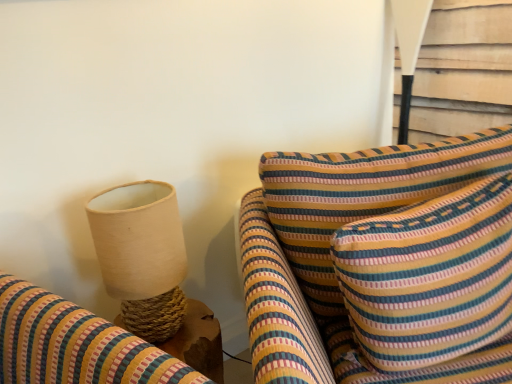
This screenshot has height=384, width=512. I want to click on natural woven lampshade at left, positioned as the 1th table lamp in bottom-to-top order, so click(142, 255).

At what (x,y) coordinates should I click in order to perform the action: click on table lamp on the left side of white fabric lampshade at upper right, positioned as the 2th table lamp in front-to-back order. Please return your answer as a coordinate pair (x, y). Looking at the image, I should click on (142, 255).

Which point is more distant from viewer, (134, 238) or (420, 16)?

The point (420, 16) is more distant.

Between natural woven lampshade at left, the second table lamp when ordered from right to left, and white fabric lampshade at upper right, the 2th table lamp positioned from the left, which one has smaller size?

white fabric lampshade at upper right, the 2th table lamp positioned from the left, is smaller.

From the image's perspective, which one is positioned higher, natural woven lampshade at left, the 1th table lamp positioned from the left, or white fabric lampshade at upper right, the 1th table lamp in the right-to-left sequence?

white fabric lampshade at upper right, the 1th table lamp in the right-to-left sequence.

Is striped fabric cushion at center behind natural woven lampshade at left, the second table lamp when ordered from right to left?

No, it is in front of natural woven lampshade at left, the second table lamp when ordered from right to left.

From a real-world perspective, between striped fabric cushion at center and natural woven lampshade at left, the 1th table lamp positioned from the left, who is vertically lower?

striped fabric cushion at center, from a real-world perspective.

Considering the sizes of objects striped fabric cushion at center and natural woven lampshade at left, the 1th table lamp positioned from the left, in the image provided, who is thinner, striped fabric cushion at center or natural woven lampshade at left, the 1th table lamp positioned from the left,?

natural woven lampshade at left, the 1th table lamp positioned from the left, is thinner.

What's the angular difference between white fabric lampshade at upper right, the 2th table lamp positioned from the left, and striped fabric cushion at center's facing directions?

The facing directions of white fabric lampshade at upper right, the 2th table lamp positioned from the left, and striped fabric cushion at center are 63.4 degrees apart.

Which point is more distant from viewer, [406,87] or [306,257]?

The point [406,87] is farther from the camera.

I want to click on furniture that appears below the white fabric lampshade at upper right, which appears as the first table lamp when viewed from the back (from a real-world perspective), so click(382, 263).

Is white fabric lampshade at upper right, positioned as the 2th table lamp in front-to-back order, shorter than striped fabric cushion at center?

Correct, white fabric lampshade at upper right, positioned as the 2th table lamp in front-to-back order, is not as tall as striped fabric cushion at center.

Considering the sizes of objects white fabric lampshade at upper right, the second table lamp positioned from the bottom, and natural woven lampshade at left, arranged as the second table lamp when viewed from the top, in the image provided, who is wider, white fabric lampshade at upper right, the second table lamp positioned from the bottom, or natural woven lampshade at left, arranged as the second table lamp when viewed from the top,?

Wider between the two is natural woven lampshade at left, arranged as the second table lamp when viewed from the top.

Is white fabric lampshade at upper right, the second table lamp positioned from the bottom, facing towards natural woven lampshade at left, which appears as the 2th table lamp when viewed from the back?

Yes, white fabric lampshade at upper right, the second table lamp positioned from the bottom, faces towards natural woven lampshade at left, which appears as the 2th table lamp when viewed from the back.

Is white fabric lampshade at upper right, acting as the first table lamp starting from the top, at the right side of natural woven lampshade at left, acting as the first table lamp starting from the front?

Yes.

Does point (162, 227) come behind point (408, 191)?

No, it is not.

Considering the sizes of objects natural woven lampshade at left, the 1th table lamp positioned from the left, and striped fabric cushion at center in the image provided, who is wider, natural woven lampshade at left, the 1th table lamp positioned from the left, or striped fabric cushion at center?

Wider between the two is striped fabric cushion at center.

Is natural woven lampshade at left, acting as the first table lamp starting from the front, completely or partially outside of striped fabric cushion at center?

Yes, natural woven lampshade at left, acting as the first table lamp starting from the front, is not within striped fabric cushion at center.

Consider the image. Is striped fabric cushion at center to the left of white fabric lampshade at upper right, the second table lamp positioned from the bottom, from the viewer's perspective?

Correct, you'll find striped fabric cushion at center to the left of white fabric lampshade at upper right, the second table lamp positioned from the bottom.

Considering the points (298, 279) and (400, 134), which point is behind, point (298, 279) or point (400, 134)?

Point (400, 134)

Is striped fabric cushion at center not near white fabric lampshade at upper right, the 1th table lamp in the right-to-left sequence?

Actually, striped fabric cushion at center and white fabric lampshade at upper right, the 1th table lamp in the right-to-left sequence, are a little close together.

Is striped fabric cushion at center taller than white fabric lampshade at upper right, the 2th table lamp positioned from the left?

Yes.

You are a GUI agent. You are given a task and a screenshot of the screen. Output one action in this format:
    pyautogui.click(x=<x>, y=<y>)
    Task: Click on the table lamp lying below the white fabric lampshade at upper right, positioned as the 2th table lamp in front-to-back order (from the image's perspective)
    The width and height of the screenshot is (512, 384).
    Given the screenshot: What is the action you would take?
    pyautogui.click(x=142, y=255)

Locate an element on the screen. The width and height of the screenshot is (512, 384). table lamp to the left of striped fabric cushion at center is located at coordinates (142, 255).

Estimate the real-world distances between objects in this image. Which object is closer to striped fabric cushion at center, white fabric lampshade at upper right, the second table lamp positioned from the bottom, or natural woven lampshade at left, positioned as the 1th table lamp in bottom-to-top order?

Based on the image, natural woven lampshade at left, positioned as the 1th table lamp in bottom-to-top order, appears to be nearer to striped fabric cushion at center.

Based on the photo, based on their spatial positions, is striped fabric cushion at center or natural woven lampshade at left, the 1th table lamp positioned from the left, further from white fabric lampshade at upper right, acting as the first table lamp starting from the top?

natural woven lampshade at left, the 1th table lamp positioned from the left, is further to white fabric lampshade at upper right, acting as the first table lamp starting from the top.

When comparing their distances from white fabric lampshade at upper right, acting as the first table lamp starting from the top, does natural woven lampshade at left, arranged as the second table lamp when viewed from the top, or striped fabric cushion at center seem further?

→ Based on the image, natural woven lampshade at left, arranged as the second table lamp when viewed from the top, appears to be further to white fabric lampshade at upper right, acting as the first table lamp starting from the top.

Considering their positions, is white fabric lampshade at upper right, the second table lamp positioned from the bottom, positioned closer to natural woven lampshade at left, which appears as the 2th table lamp when viewed from the back, than striped fabric cushion at center?

striped fabric cushion at center lies closer to natural woven lampshade at left, which appears as the 2th table lamp when viewed from the back, than the other object.

Considering their positions, is striped fabric cushion at center positioned further to natural woven lampshade at left, acting as the first table lamp starting from the front, than white fabric lampshade at upper right, the second table lamp positioned from the bottom?

white fabric lampshade at upper right, the second table lamp positioned from the bottom, is positioned further to the anchor natural woven lampshade at left, acting as the first table lamp starting from the front.

When comparing their distances from striped fabric cushion at center, does natural woven lampshade at left, which appears as the 2th table lamp when viewed from the back, or white fabric lampshade at upper right, the 2th table lamp positioned from the left, seem closer?

natural woven lampshade at left, which appears as the 2th table lamp when viewed from the back, is positioned closer to the anchor striped fabric cushion at center.

The width and height of the screenshot is (512, 384). Find the location of `table lamp positioned between striped fabric cushion at center and white fabric lampshade at upper right, acting as the first table lamp starting from the top, from near to far`. table lamp positioned between striped fabric cushion at center and white fabric lampshade at upper right, acting as the first table lamp starting from the top, from near to far is located at coordinates (142, 255).